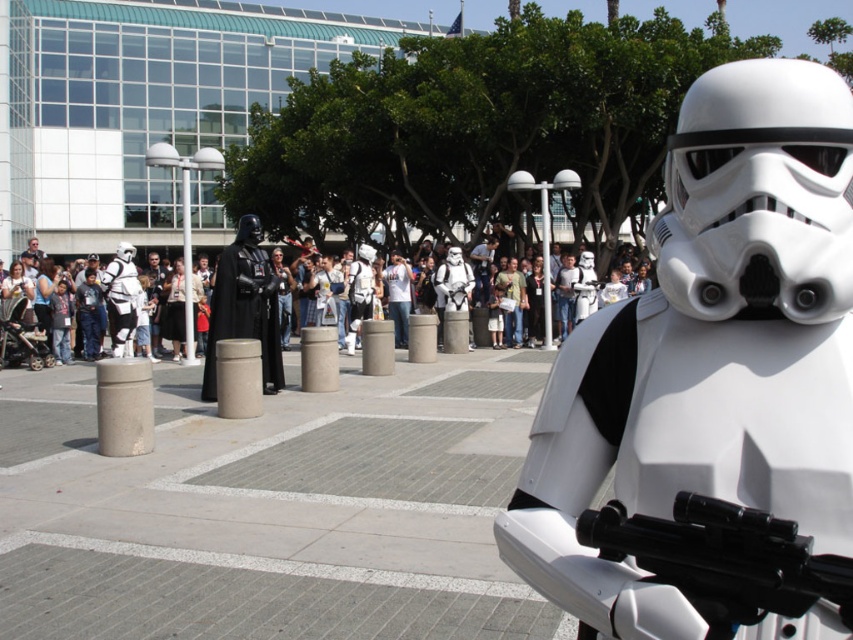
You are a photographer at the event and want to capture both the Stormtrooper and the Darth Vader costume in your shot. You notice two points marked in the image, one at coordinates point (729,84) and the other at point (218,307). Which point should you focus on to ensure both subjects are in clear view?

You should focus on point (729,84) because it is closer to the viewer, allowing both the Stormtrooper and Darth Vader to be in clear focus.

You are a photographer at the event and want to capture a photo that includes both the matte black armor at center and the white matte stormtrooper at center. Which one of these two will appear larger in the photo?

The matte black armor at center will appear larger in the photo because it is closer to the viewer than the white matte stormtrooper at center.